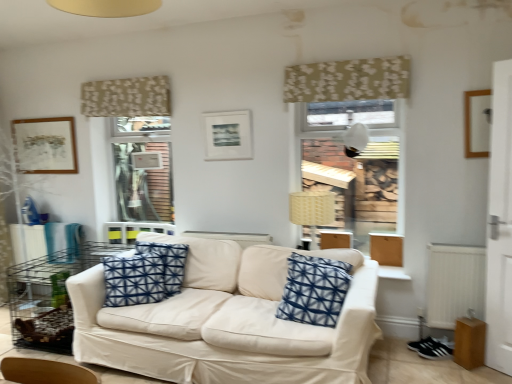
Where is `free point above beige floral fabric at upper center, acting as the first curtain starting from the left (from a real-world perspective)`? The width and height of the screenshot is (512, 384). free point above beige floral fabric at upper center, acting as the first curtain starting from the left (from a real-world perspective) is located at coordinates (118, 78).